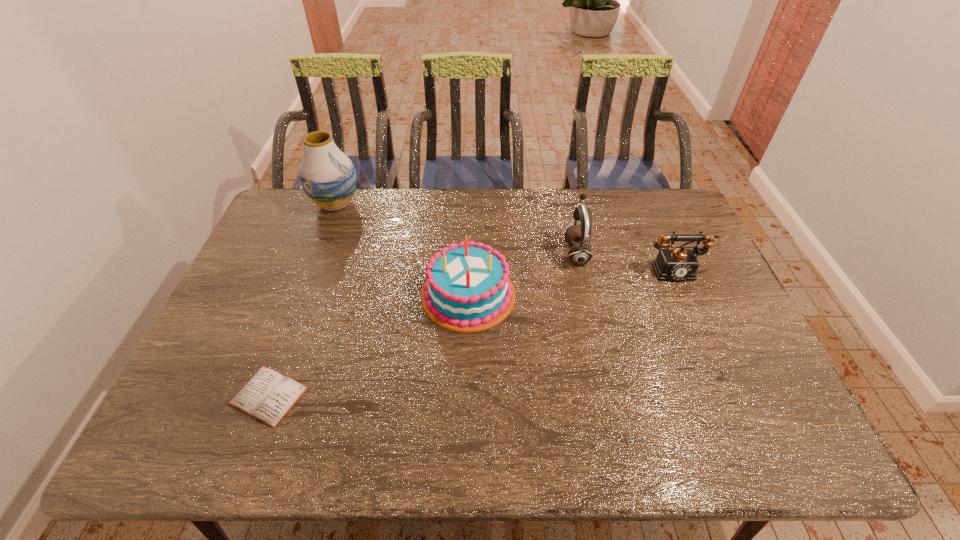
I want to click on object located in the near left corner section of the desktop, so click(268, 396).

Where is `vacant space at the far edge`? The width and height of the screenshot is (960, 540). vacant space at the far edge is located at coordinates (402, 204).

What are the coordinates of `free space at the near edge` in the screenshot? It's located at (429, 439).

Find the location of `vacant space at the left edge of the desktop`. vacant space at the left edge of the desktop is located at coordinates (225, 337).

Locate an element on the screen. The height and width of the screenshot is (540, 960). blank space at the right edge of the desktop is located at coordinates (694, 290).

In the image, there is a desktop. At what (x,y) coordinates should I click in order to perform the action: click on free space at the near left corner. Please return your answer as a coordinate pair (x, y). Image resolution: width=960 pixels, height=540 pixels. Looking at the image, I should click on pos(223,444).

In the image, there is a desktop. What are the coordinates of `vacant region at the far right corner` in the screenshot? It's located at (668, 217).

I want to click on free space between the nearest object and the telephone, so click(471, 332).

Locate an element on the screen. unoccupied position between the earphone and the telephone is located at coordinates (625, 261).

Where is `free space between the farthest object and the fourth object from left to right`? free space between the farthest object and the fourth object from left to right is located at coordinates (456, 228).